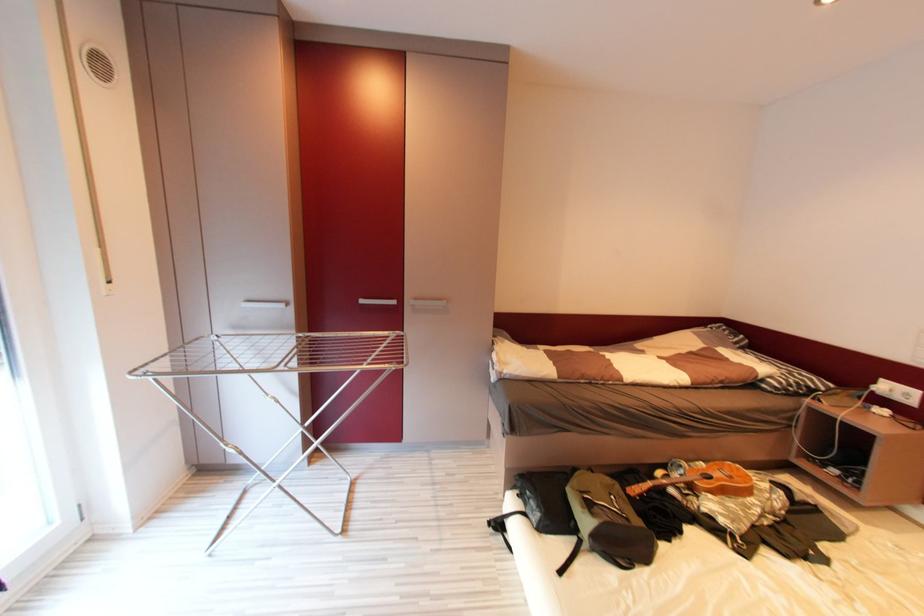
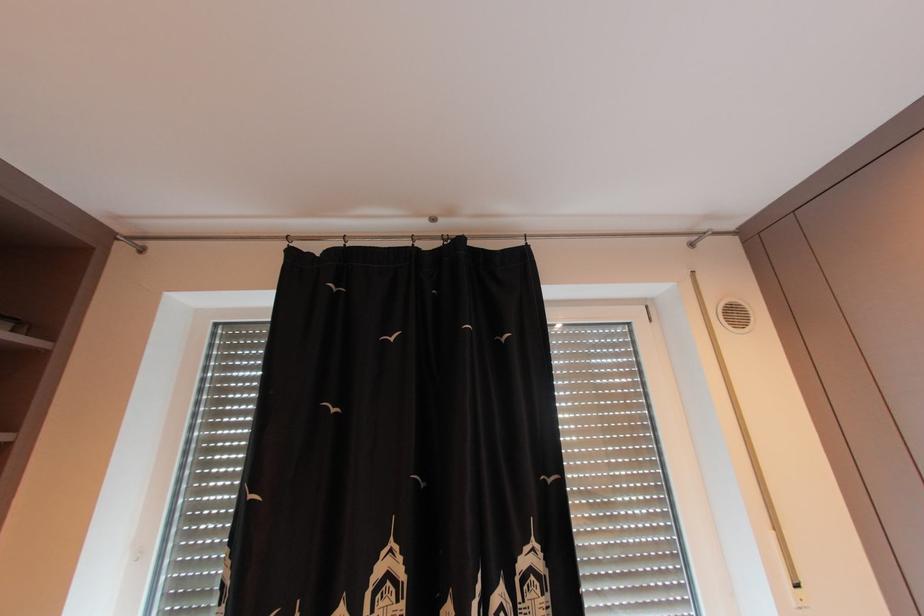
In the scene shown: First-person continuous shooting, in which direction is the camera rotating?

The rotation direction of the camera is left-up.